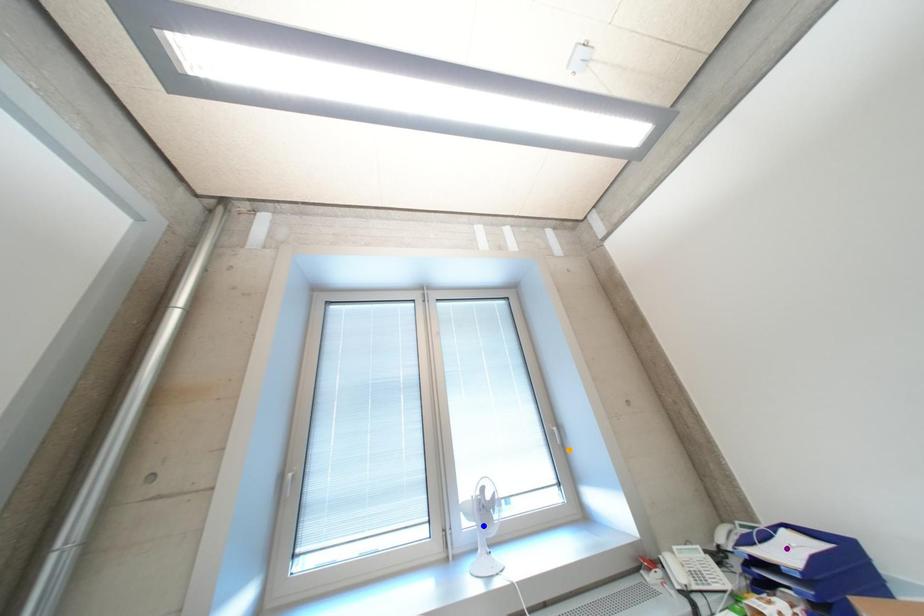
Order these from nearest to farthest:
- orange point
- purple point
- blue point

orange point
blue point
purple point